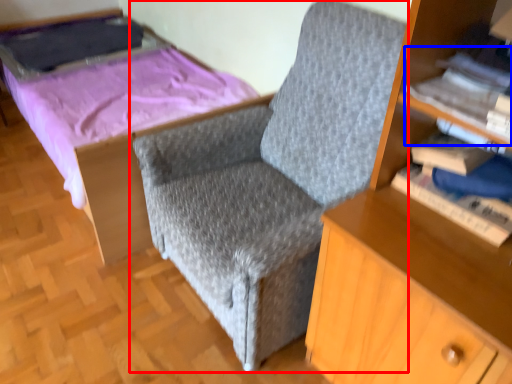
Question: Which object is further to the camera taking this photo, chair (highlighted by a red box) or book (highlighted by a blue box)?

Choices:
 (A) chair
 (B) book

Answer: (B)